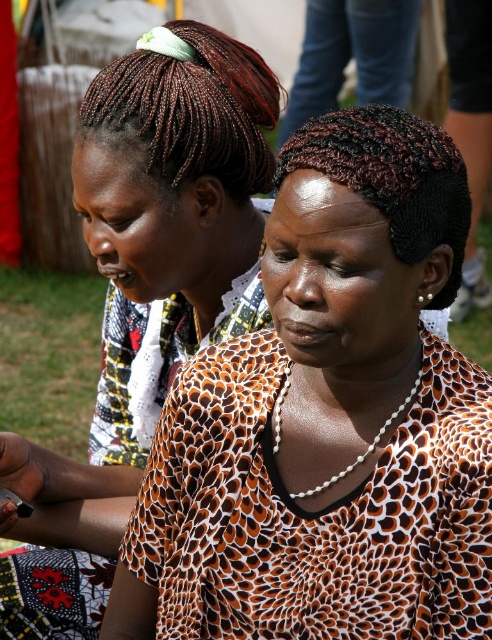
Question: Which point is farther to the camera?

Choices:
 (A) (115, 106)
 (B) (396, 200)

Answer: (A)

Question: Which object appears farthest from the camera in this image?

Choices:
 (A) black braided hair at center
 (B) matte leopard print blouse at center

Answer: (B)

Question: Is braided dark brown hair at upper left to the left of black braided hair at center from the viewer's perspective?

Choices:
 (A) yes
 (B) no

Answer: (A)

Question: Is printed fabric blouse at center further to the viewer compared to matte leopard print blouse at center?

Choices:
 (A) yes
 (B) no

Answer: (B)

Question: Does printed fabric blouse at center have a larger size compared to braided dark brown hair at upper left?

Choices:
 (A) yes
 (B) no

Answer: (A)

Question: Which point is closer to the camera taking this photo?

Choices:
 (A) (49, 636)
 (B) (295, 573)

Answer: (B)